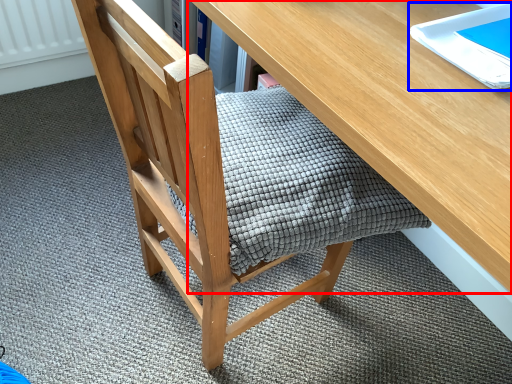
Question: Among these objects, which one is nearest to the camera, desk (highlighted by a red box) or notebook (highlighted by a blue box)?

Choices:
 (A) desk
 (B) notebook

Answer: (A)